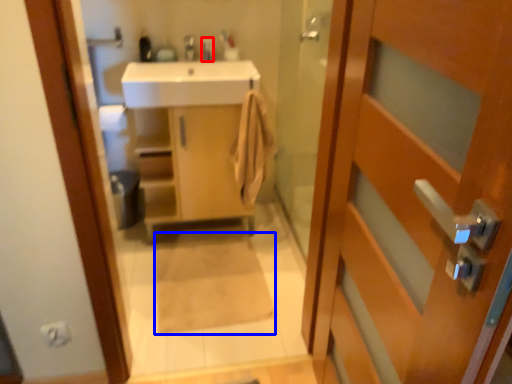
Question: Among these objects, which one is nearest to the camera, toiletry (highlighted by a red box) or bath mat (highlighted by a blue box)?

Choices:
 (A) toiletry
 (B) bath mat

Answer: (B)